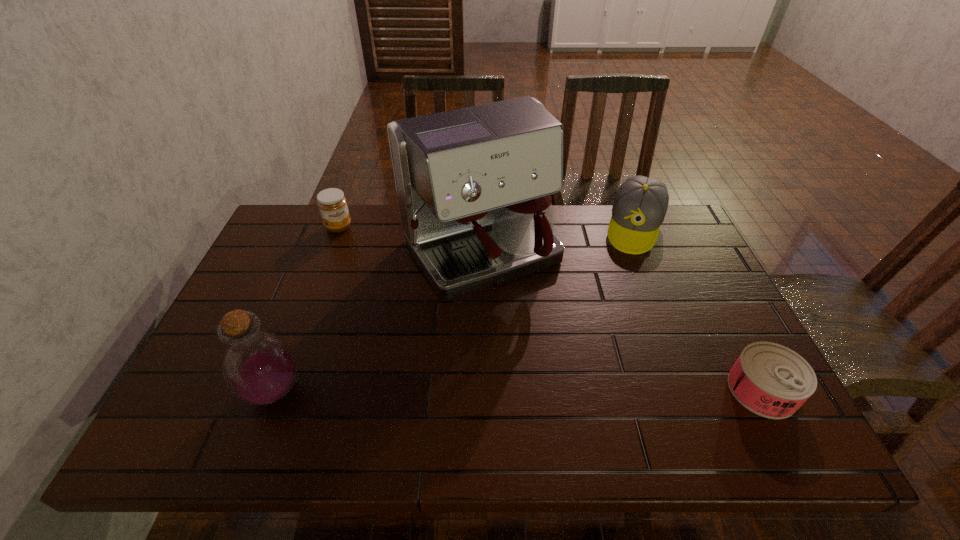
This screenshot has width=960, height=540. Identify the location of free space on the desktop that is between the fourth shortest object and the can and is positioned on the front of the coffee maker near the spout. (575, 390).

Identify the location of free spot on the desktop that is between the bottle and the can and is positioned on the front label of the jam. (449, 390).

Locate an element on the screen. The width and height of the screenshot is (960, 540). free spot on the desktop that is between the bottle and the shortest object and is positioned on the front-facing side of the third shortest object is located at coordinates (590, 390).